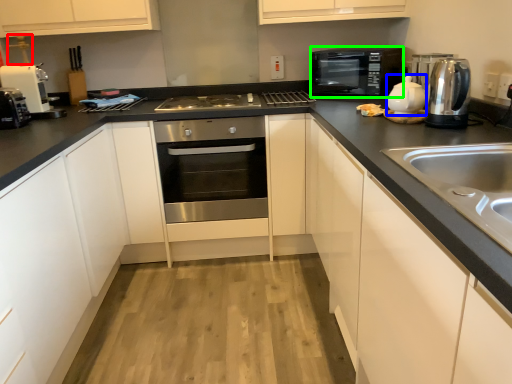
Question: Considering the real-world distances, which object is closest to faucet (highlighted by a red box)? tea pot (highlighted by a blue box) or home appliance (highlighted by a green box).

Choices:
 (A) tea pot
 (B) home appliance

Answer: (B)